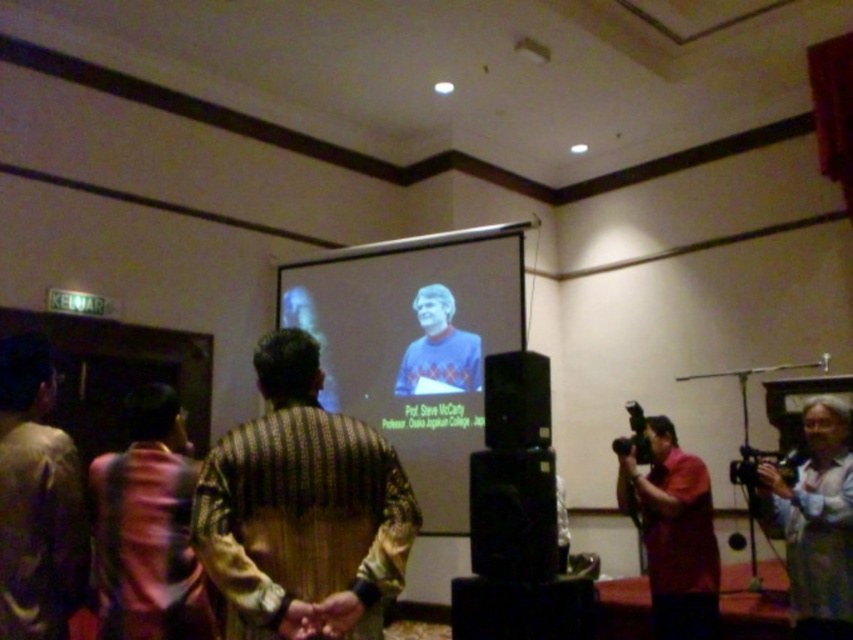
Can you confirm if brown textured shirt at lower left is positioned below pink fabric camera at lower right?

No, brown textured shirt at lower left is not below pink fabric camera at lower right.

Image resolution: width=853 pixels, height=640 pixels. I want to click on brown textured shirt at lower left, so click(148, 528).

Which is above, patterned fabric shirt at center or blue sweater at center?

Positioned higher is blue sweater at center.

Is patterned fabric shirt at center above blue sweater at center?

Incorrect, patterned fabric shirt at center is not positioned above blue sweater at center.

Measure the distance between patterned fabric shirt at center and camera.

patterned fabric shirt at center is 5.82 feet away from camera.

This screenshot has width=853, height=640. I want to click on patterned fabric shirt at center, so click(302, 509).

Is matte white screen at center to the left of dark brown textured shirt at left from the viewer's perspective?

In fact, matte white screen at center is to the right of dark brown textured shirt at left.

Which is below, matte white screen at center or dark brown textured shirt at left?

dark brown textured shirt at left

The image size is (853, 640). Identify the location of matte white screen at center. (415, 344).

Image resolution: width=853 pixels, height=640 pixels. I want to click on matte white screen at center, so click(415, 344).